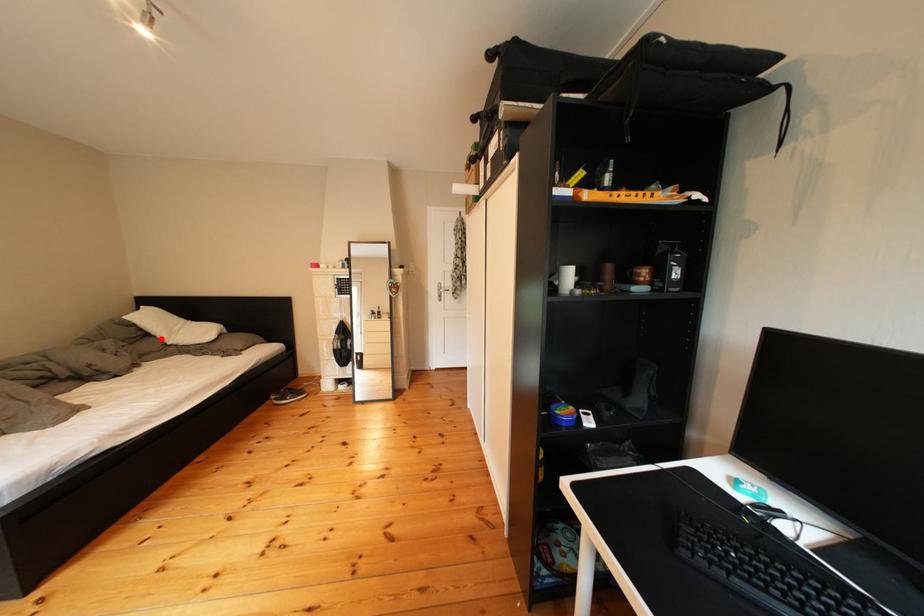
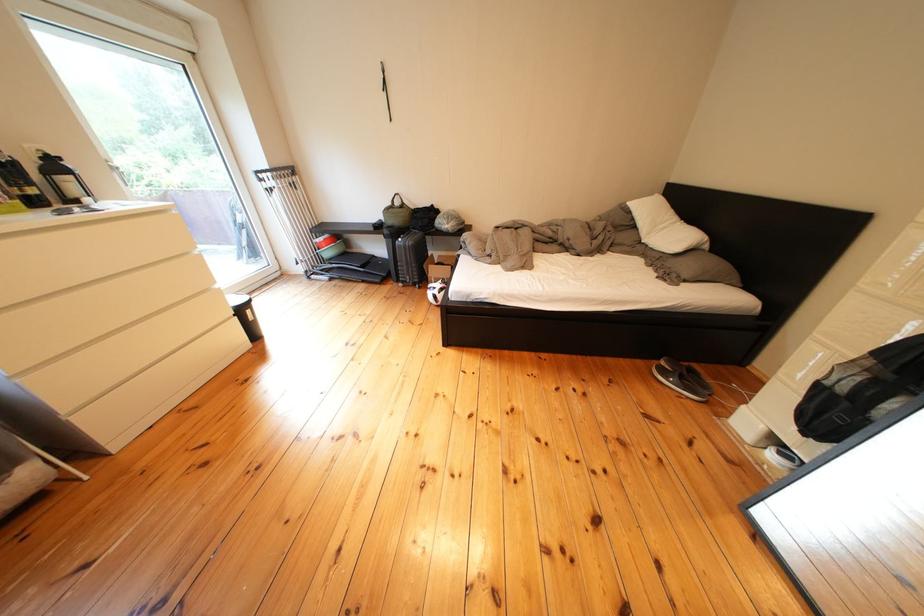
The point at the highlighted location is marked in the first image. Where is the corresponding point in the second image?

(649, 230)